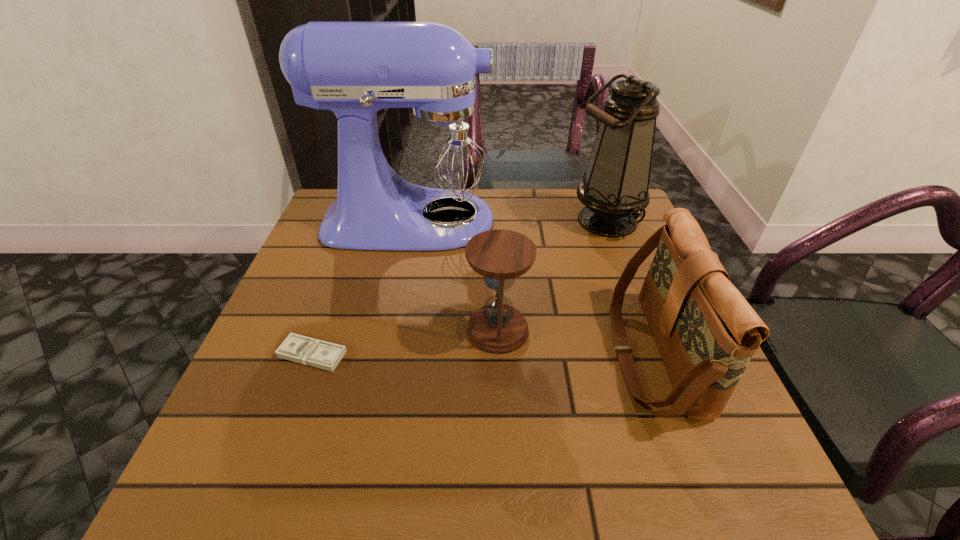
What are the coordinates of `vacant space that is in between the shoulder bag and the shortest object` in the screenshot? It's located at (482, 354).

In order to click on empty location between the money and the oil lamp in this screenshot , I will do `click(459, 287)`.

The height and width of the screenshot is (540, 960). I want to click on empty space between the tallest object and the shortest object, so click(x=364, y=287).

Image resolution: width=960 pixels, height=540 pixels. I want to click on free space between the shortest object and the fourth shortest object, so click(x=459, y=287).

This screenshot has height=540, width=960. Identify the location of free space between the shoulder bag and the money. (482, 354).

Locate an element on the screen. The height and width of the screenshot is (540, 960). object that is the second closest one to the second shortest object is located at coordinates coord(427,187).

Identify which object is located as the nearest to the mixer. Please provide its 2D coordinates. Your answer should be formatted as a tuple, i.e. [(x, y)], where the tuple contains the x and y coordinates of a point satisfying the conditions above.

[(614, 188)]

In order to click on blank space that satisfies the following two spatial constraints: 1. at the mixing area of the hourglass; 2. on the left side of the mixer in this screenshot , I will do `click(395, 330)`.

The height and width of the screenshot is (540, 960). I want to click on vacant area that satisfies the following two spatial constraints: 1. on the front-facing side of the shoulder bag; 2. on the front side of the money, so click(653, 354).

Locate an element on the screen. This screenshot has width=960, height=540. blank area in the image that satisfies the following two spatial constraints: 1. on the front-facing side of the shoulder bag; 2. on the front side of the shortest object is located at coordinates (653, 354).